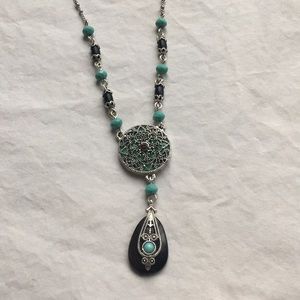
The width and height of the screenshot is (300, 300). Find the location of `link attaching top of black pendant`. link attaching top of black pendant is located at coordinates (155, 200).